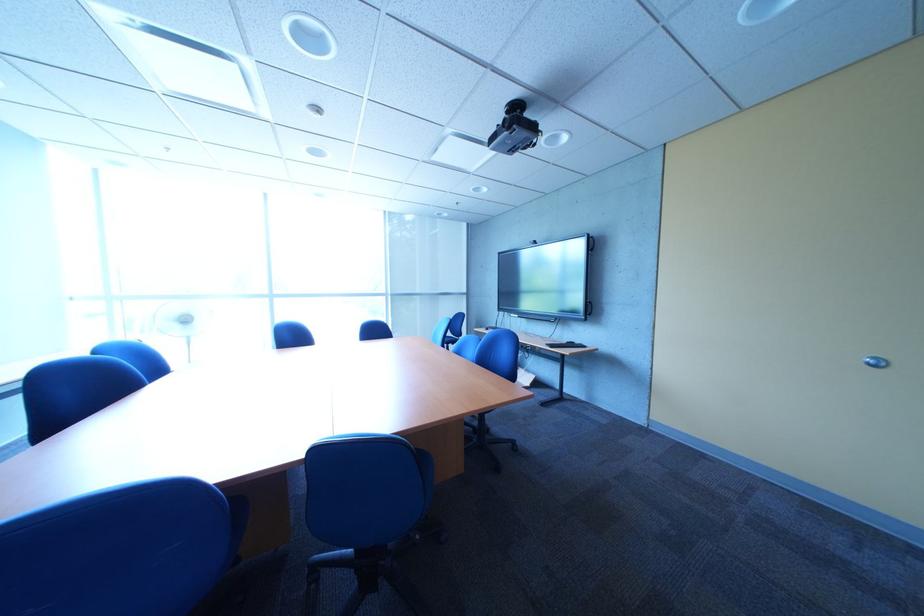
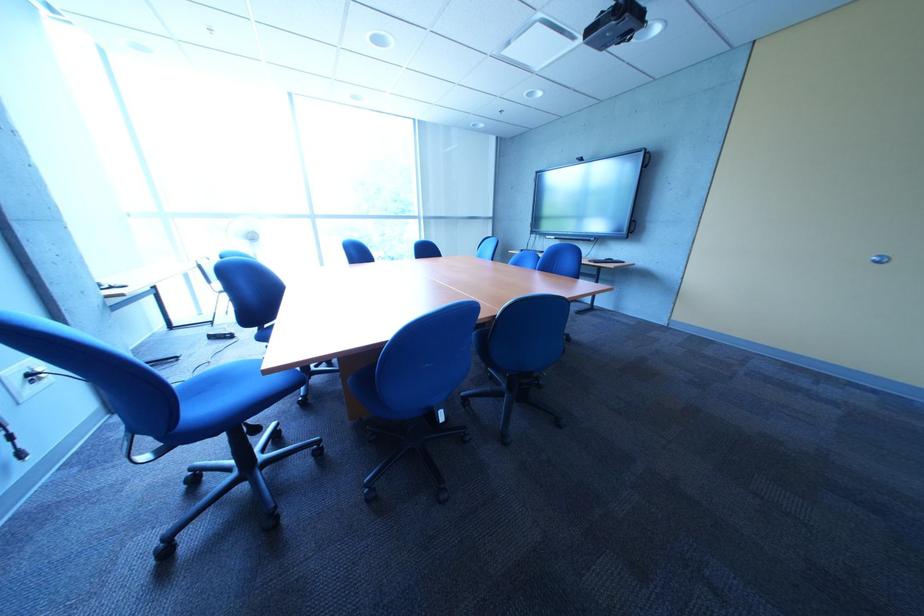
Question: The first image is from the beginning of the video and the second image is from the end. How did the camera likely rotate when shooting the video?

Choices:
 (A) Left
 (B) Right
 (C) Up
 (D) Down

Answer: (D)